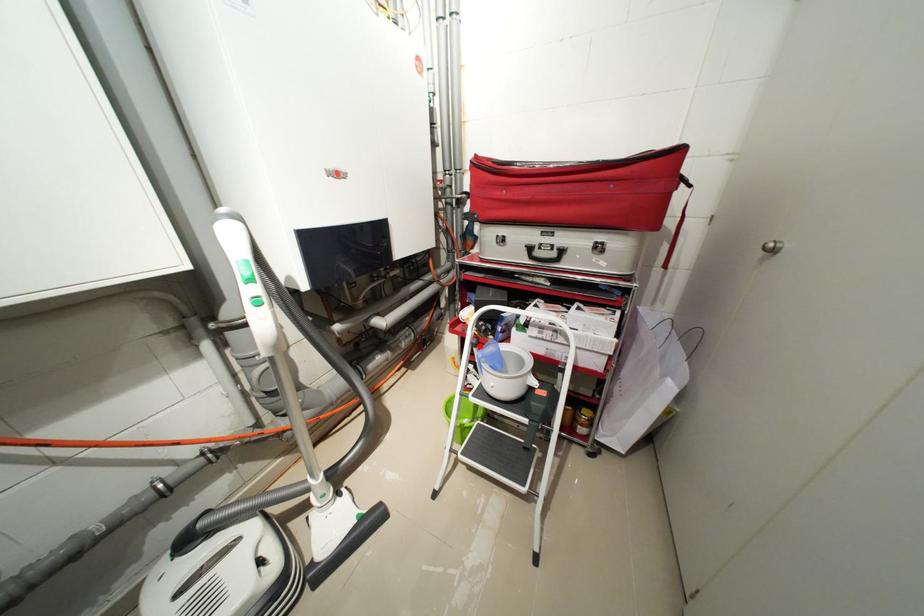
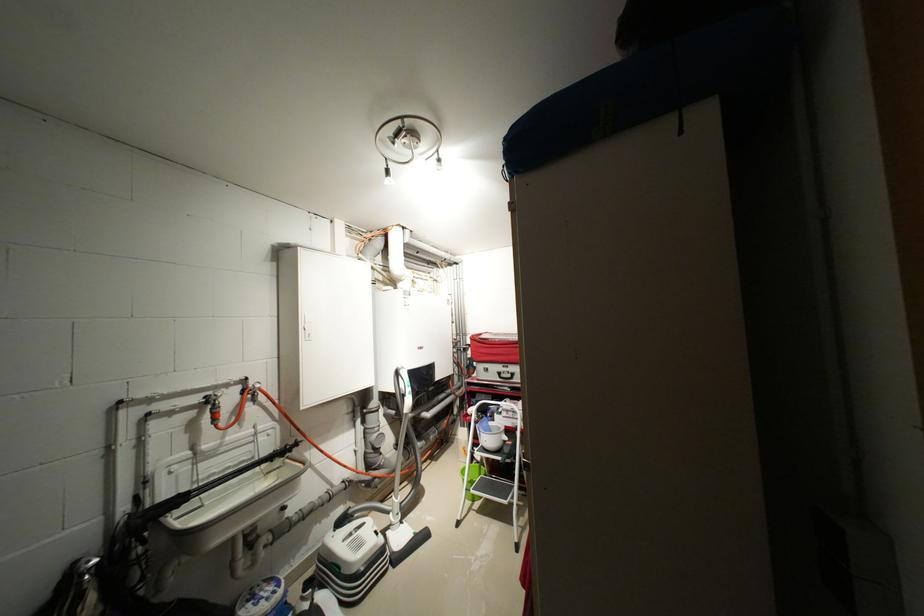
Question: I am providing you with two images of the same scene from different viewpoints. Image1 has a red point marked. In image2, the corresponding 3D location appears at what relative position? Reply with the corresponding letter.

Choices:
 (A) Closer
 (B) Farther

Answer: (B)